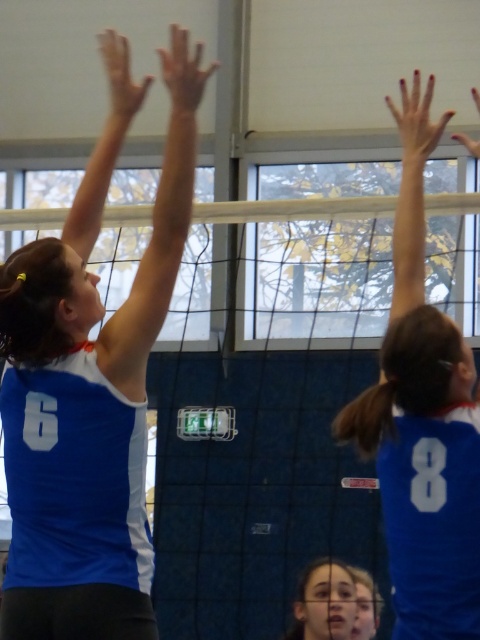
Between white mesh net at center and blue jersey at upper left, which one is positioned lower?

blue jersey at upper left is below.

Can you confirm if white mesh net at center is positioned below blue jersey at upper left?

No, white mesh net at center is not below blue jersey at upper left.

The image size is (480, 640). What are the coordinates of `white mesh net at center` in the screenshot? It's located at (255, 484).

Does white mesh net at center lie behind blue jersey at upper right?

Yes.

Is white mesh net at center below blue jersey at upper right?

No.

Who is more forward, (205, 595) or (477, 518)?

Point (477, 518) is in front.

Locate an element on the screen. The image size is (480, 640). white mesh net at center is located at coordinates (255, 484).

Can you confirm if blue jersey at upper left is smaller than blue jersey at upper right?

Incorrect, blue jersey at upper left is not smaller in size than blue jersey at upper right.

Is blue jersey at upper left shorter than blue jersey at upper right?

In fact, blue jersey at upper left may be taller than blue jersey at upper right.

Does point (60, 618) lie in front of point (464, 592)?

No, it is behind (464, 592).

Identify the location of blue jersey at upper left. (90, 385).